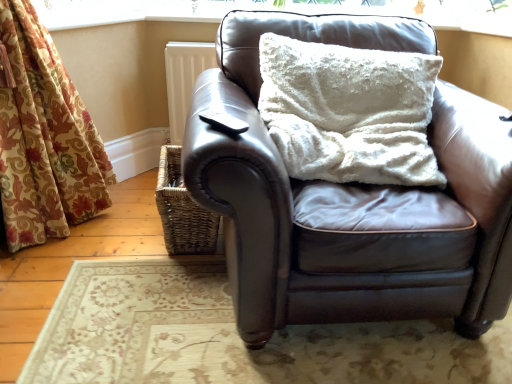
Question: From a real-world perspective, is woven brown basket at lower left located beneath black matte remote control at upper center?

Choices:
 (A) no
 (B) yes

Answer: (B)

Question: Is woven brown basket at lower left thinner than black matte remote control at upper center?

Choices:
 (A) no
 (B) yes

Answer: (A)

Question: Is woven brown basket at lower left further to the viewer compared to black matte remote control at upper center?

Choices:
 (A) no
 (B) yes

Answer: (B)

Question: Does woven brown basket at lower left have a larger size compared to black matte remote control at upper center?

Choices:
 (A) no
 (B) yes

Answer: (B)

Question: From the image's perspective, is woven brown basket at lower left below black matte remote control at upper center?

Choices:
 (A) no
 (B) yes

Answer: (B)

Question: Is woven brown basket at lower left facing away from black matte remote control at upper center?

Choices:
 (A) yes
 (B) no

Answer: (B)

Question: From a real-world perspective, is white textured cushion at upper center under black matte remote control at upper center?

Choices:
 (A) yes
 (B) no

Answer: (B)

Question: Could you tell me if white textured cushion at upper center is facing black matte remote control at upper center?

Choices:
 (A) no
 (B) yes

Answer: (B)

Question: Can you confirm if white textured cushion at upper center is wider than black matte remote control at upper center?

Choices:
 (A) no
 (B) yes

Answer: (B)

Question: Is white textured cushion at upper center outside of black matte remote control at upper center?

Choices:
 (A) no
 (B) yes

Answer: (B)

Question: Does white textured cushion at upper center have a lesser height compared to black matte remote control at upper center?

Choices:
 (A) yes
 (B) no

Answer: (B)

Question: From the image's perspective, is white textured cushion at upper center located beneath black matte remote control at upper center?

Choices:
 (A) no
 (B) yes

Answer: (A)

Question: From a real-world perspective, is matte brown leather couch at center below woven brown basket at lower left?

Choices:
 (A) no
 (B) yes

Answer: (A)